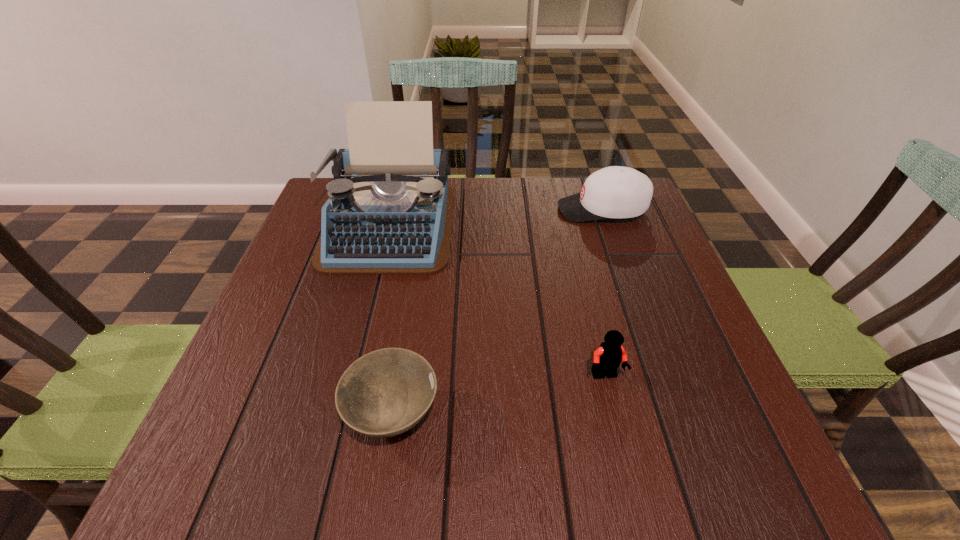
Where is `vacant space at the right edge of the desktop`? The height and width of the screenshot is (540, 960). vacant space at the right edge of the desktop is located at coordinates (719, 435).

Locate an element on the screen. This screenshot has width=960, height=540. free space that is in between the shortest object and the baseball cap is located at coordinates (497, 313).

Identify the location of free spot between the baseball cap and the Lego. (604, 293).

This screenshot has width=960, height=540. What are the coordinates of `free area in between the shortest object and the Lego` in the screenshot? It's located at (499, 395).

Identify the location of vacant space that is in between the shortest object and the baseball cap. (497, 313).

You are a GUI agent. You are given a task and a screenshot of the screen. Output one action in this format:
    pyautogui.click(x=<x>, y=<y>)
    Task: Click on the unoccupied position between the baseball cap and the tallest object
    
    Given the screenshot: What is the action you would take?
    pyautogui.click(x=495, y=217)

You are a GUI agent. You are given a task and a screenshot of the screen. Output one action in this format:
    pyautogui.click(x=<x>, y=<y>)
    Task: Click on the blank region between the bowl and the Lego
    
    Given the screenshot: What is the action you would take?
    pyautogui.click(x=499, y=395)

Locate an element on the screen. unoccupied area between the bowl and the Lego is located at coordinates (499, 395).

The height and width of the screenshot is (540, 960). In order to click on free space between the typewriter and the baseball cap in this screenshot , I will do `click(495, 217)`.

Locate an element on the screen. The width and height of the screenshot is (960, 540). free space between the baseball cap and the shortest object is located at coordinates (497, 313).